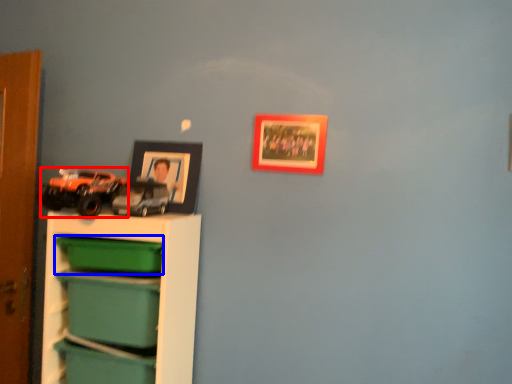
Question: Which of the following is the closest to the observer, toy (highlighted by a red box) or storage box (highlighted by a blue box)?

Choices:
 (A) toy
 (B) storage box

Answer: (A)